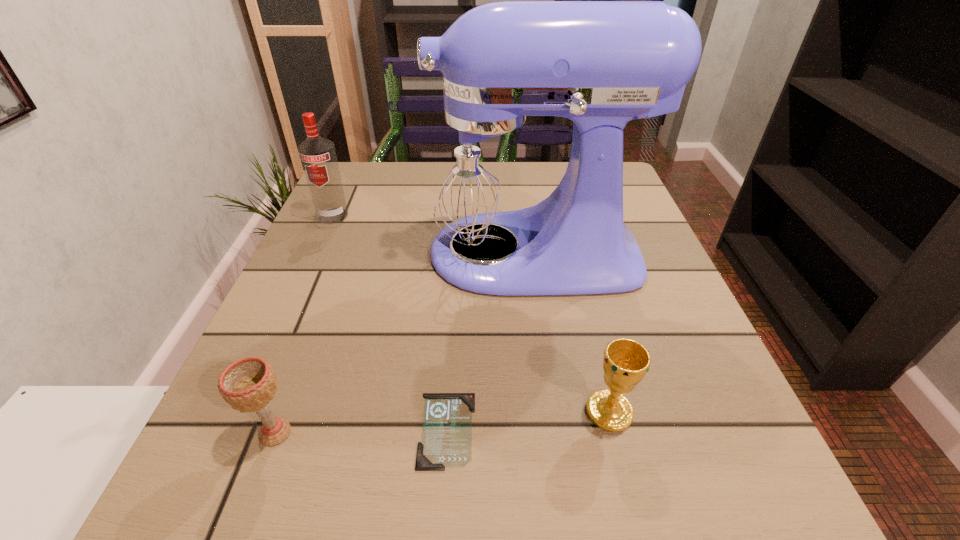
Find the location of a particular element. Image resolution: width=960 pixels, height=540 pixels. vacant space that satisfies the following two spatial constraints: 1. on the front label of the second tallest object; 2. on the right side of the identity card is located at coordinates (235, 430).

Locate an element on the screen. The height and width of the screenshot is (540, 960). free spot that satisfies the following two spatial constraints: 1. on the front label of the second tallest object; 2. on the left side of the left chalice is located at coordinates (234, 433).

In order to click on free space that satisfies the following two spatial constraints: 1. on the back side of the identity card; 2. on the left side of the right chalice in this screenshot , I will do `click(448, 411)`.